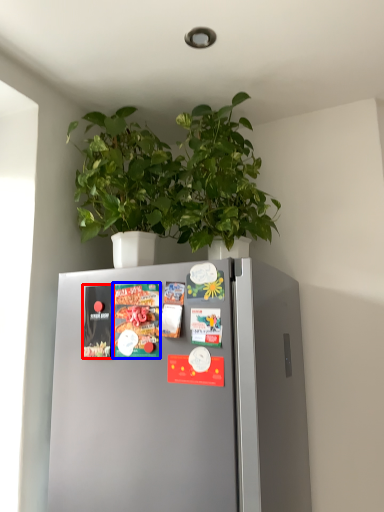
Question: Which point is closer to the camera, magazine (highlighted by a red box) or magazine (highlighted by a blue box)?

Choices:
 (A) magazine
 (B) magazine

Answer: (B)